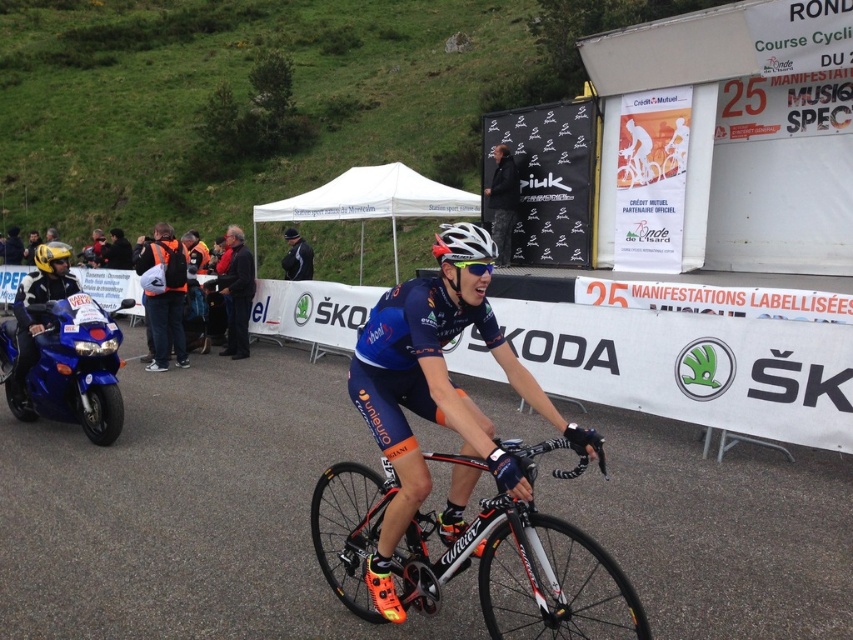
You are a photographer at the cycling event and need to position your camera to capture the white matte bicycle helmet at center. According to the coordinates provided, where should you aim your camera?

The white matte bicycle helmet at center is located at coordinates point (x=463, y=243), so you should aim your camera towards that point to capture it.

In the scene shown: You are a photographer at the cycling event. You want to capture a photo that includes both the dark blue jacket at center and the black textured jacket at upper center. The minimum distance between the two jackets required for your camera lens to focus on both is 10 feet. Will your camera be able to focus on both jackets in the same shot?

The dark blue jacket at center and the black textured jacket at upper center are 12.32 feet apart from each other, which exceeds the minimum required distance of 10 feet. Therefore, the camera can focus on both jackets in the same shot.

You are a photographer positioned at the point with coordinates point (236, 292). You want to capture a photo of the cyclist in the foreground and the motorcycle to the left. Will the dark blue jacket at center be in your frame? Please explain.

The point (236, 292) corresponds to the dark blue jacket at center, so if you are positioned there, the dark blue jacket at center will be in your frame as the main subject. The cyclist in the foreground and motorcycle to the left may also be partially visible depending on the camera angle and zoom level.